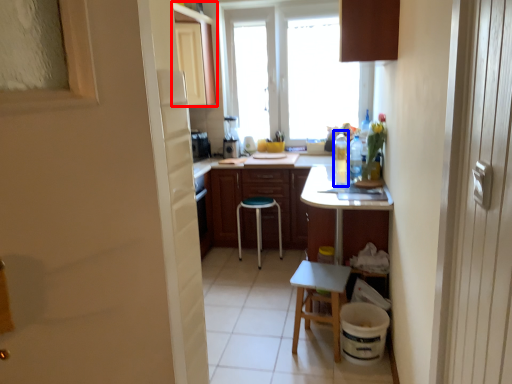
Question: Among these objects, which one is farthest to the camera, cabinetry (highlighted by a red box) or bottle (highlighted by a blue box)?

Choices:
 (A) cabinetry
 (B) bottle

Answer: (A)